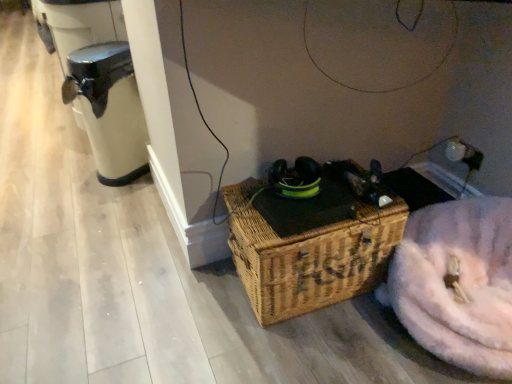
Question: Is black plastic water heater at left wider than white fluffy washer at lower right?

Choices:
 (A) yes
 (B) no

Answer: (B)

Question: From a real-world perspective, does black plastic water heater at left sit lower than white fluffy washer at lower right?

Choices:
 (A) no
 (B) yes

Answer: (A)

Question: Is black plastic water heater at left taller than white fluffy washer at lower right?

Choices:
 (A) no
 (B) yes

Answer: (B)

Question: Considering the relative sizes of black plastic water heater at left and white fluffy washer at lower right in the image provided, is black plastic water heater at left smaller than white fluffy washer at lower right?

Choices:
 (A) no
 (B) yes

Answer: (B)

Question: Is black plastic water heater at left at the right side of white fluffy washer at lower right?

Choices:
 (A) yes
 (B) no

Answer: (B)

Question: Considering the positions of black plastic water heater at left and white fluffy washer at lower right in the image, is black plastic water heater at left bigger or smaller than white fluffy washer at lower right?

Choices:
 (A) small
 (B) big

Answer: (A)

Question: Considering their positions, is black plastic water heater at left located in front of or behind white fluffy washer at lower right?

Choices:
 (A) behind
 (B) front

Answer: (A)

Question: From the image's perspective, is black plastic water heater at left positioned above or below white fluffy washer at lower right?

Choices:
 (A) below
 (B) above

Answer: (B)

Question: From a real-world perspective, is black plastic water heater at left positioned above or below white fluffy washer at lower right?

Choices:
 (A) above
 (B) below

Answer: (A)

Question: From the image's perspective, is woven brown picnic basket at center positioned above or below white fluffy washer at lower right?

Choices:
 (A) below
 (B) above

Answer: (B)

Question: Is woven brown picnic basket at center in front of or behind white fluffy washer at lower right in the image?

Choices:
 (A) front
 (B) behind

Answer: (B)

Question: Considering the positions of woven brown picnic basket at center and white fluffy washer at lower right in the image, is woven brown picnic basket at center taller or shorter than white fluffy washer at lower right?

Choices:
 (A) short
 (B) tall

Answer: (B)

Question: Looking at the image, does woven brown picnic basket at center seem bigger or smaller compared to white fluffy washer at lower right?

Choices:
 (A) big
 (B) small

Answer: (B)

Question: From the image's perspective, is white fluffy washer at lower right above or below woven brown picnic basket at center?

Choices:
 (A) above
 (B) below

Answer: (B)

Question: Is white fluffy washer at lower right bigger or smaller than woven brown picnic basket at center?

Choices:
 (A) small
 (B) big

Answer: (B)